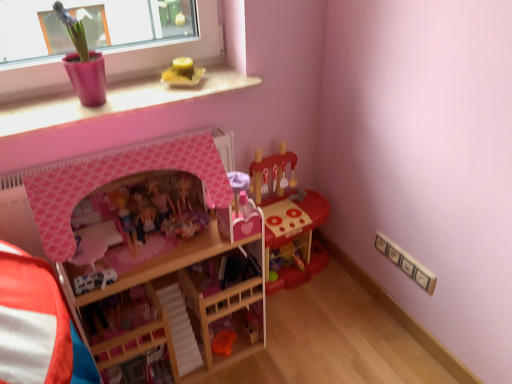
This screenshot has width=512, height=384. What are the coordinates of `free space in front of matte pink pot at upper left, the 1th toy in the left-to-right sequence` in the screenshot? It's located at (69, 123).